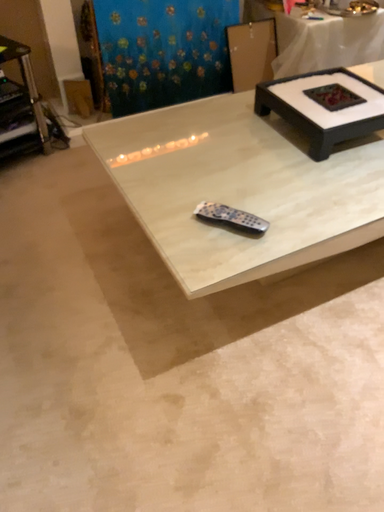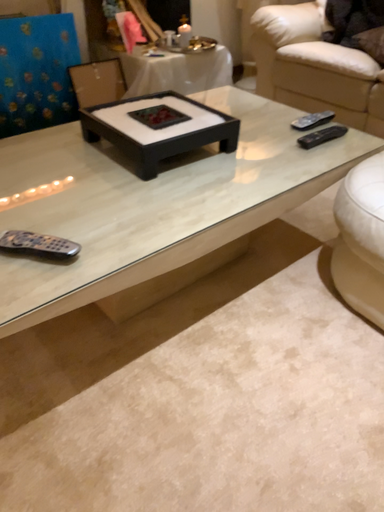
Question: Which way did the camera rotate in the video?

Choices:
 (A) rotated left
 (B) rotated right

Answer: (B)